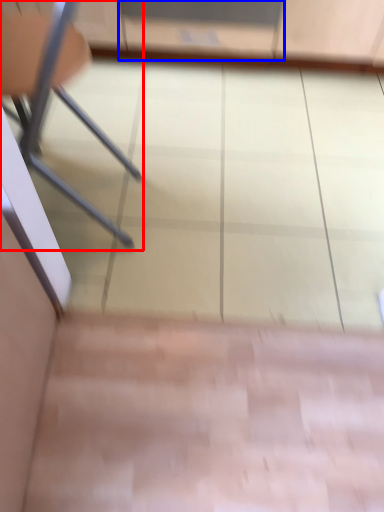
Question: Which object is closer to the camera taking this photo, chair (highlighted by a red box) or screen door (highlighted by a blue box)?

Choices:
 (A) chair
 (B) screen door

Answer: (A)